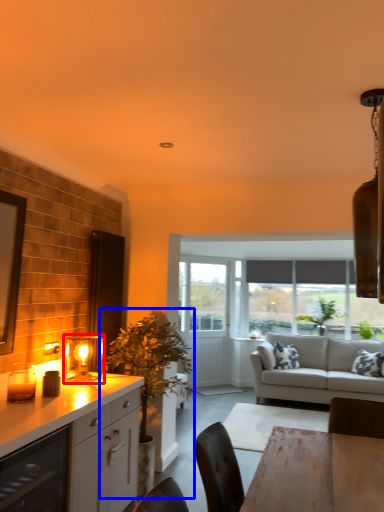
Question: Which object is closer to the camera taking this photo, light fixture (highlighted by a red box) or houseplant (highlighted by a blue box)?

Choices:
 (A) light fixture
 (B) houseplant

Answer: (A)